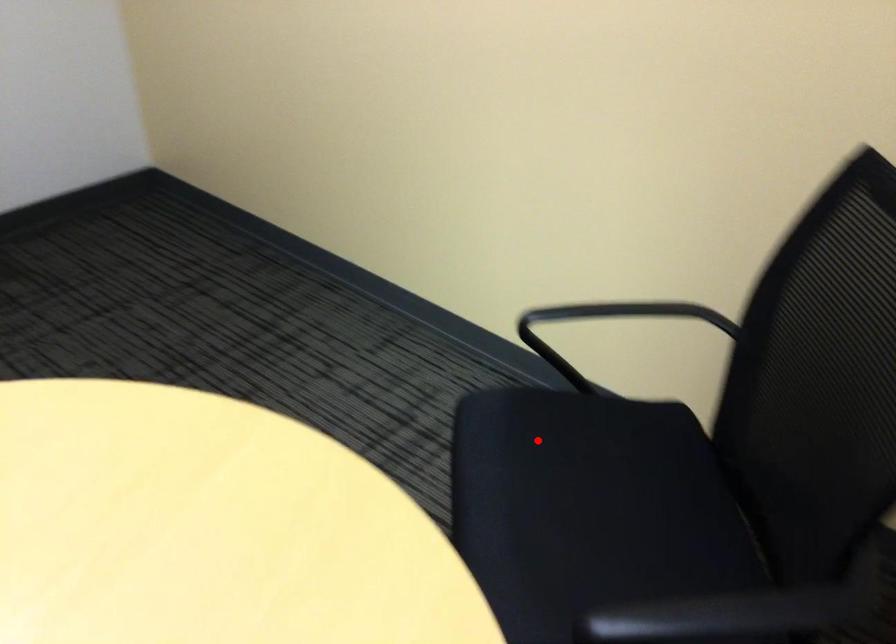
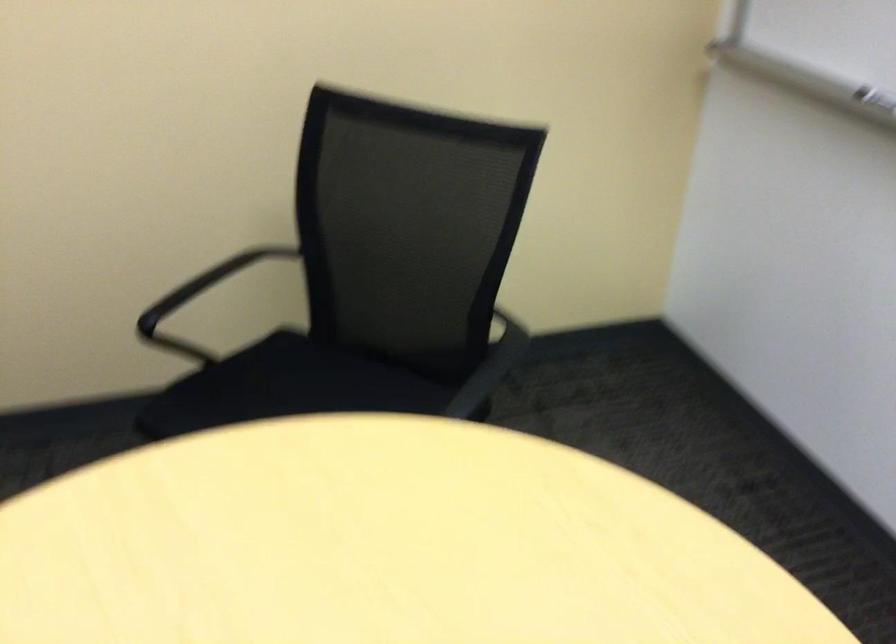
Question: A red point is marked in image1. In image2, is the corresponding 3D point closer to the camera or farther? Reply with the corresponding letter.

Choices:
 (A) The corresponding 3D point is closer.
 (B) The corresponding 3D point is farther.

Answer: (B)